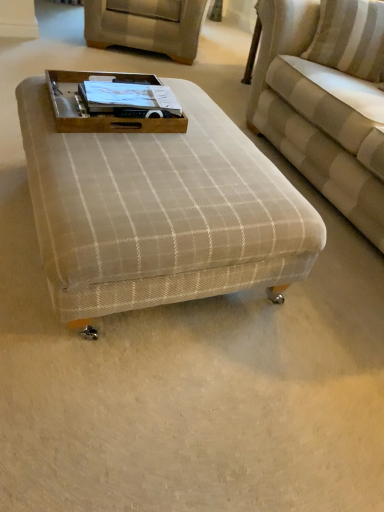
Measure the distance between point [139,74] and camera.

Point [139,74] and camera are 2.43 meters apart from each other.

Describe the element at coordinates (105, 111) in the screenshot. I see `brown wooden tray at center` at that location.

This screenshot has width=384, height=512. What do you see at coordinates (326, 100) in the screenshot? I see `beige striped fabric couch at upper right` at bounding box center [326, 100].

Locate an element on the screen. beige fabric swivel chair at upper center is located at coordinates (146, 26).

Is brown wooden tray at center located outside beige striped fabric couch at upper right?

Absolutely, brown wooden tray at center is external to beige striped fabric couch at upper right.

Based on their sizes in the image, would you say brown wooden tray at center is bigger or smaller than beige striped fabric couch at upper right?

In the image, brown wooden tray at center appears to be smaller than beige striped fabric couch at upper right.

Between brown wooden tray at center and beige striped fabric couch at upper right, which one has less height?

brown wooden tray at center.

Which object is positioned more to the right, beige plaid ottoman at center or beige fabric swivel chair at upper center?

Positioned to the right is beige plaid ottoman at center.

Locate an element on the screen. Image resolution: width=384 pixels, height=512 pixels. swivel chair on the left side of beige plaid ottoman at center is located at coordinates (146, 26).

Are beige plaid ottoman at center and beige fabric swivel chair at upper center making contact?

beige plaid ottoman at center and beige fabric swivel chair at upper center are not in contact.

What's the angular difference between beige plaid ottoman at center and beige fabric swivel chair at upper center's facing directions?

They differ by 67.4 degrees in their facing directions.

Considering the relative sizes of beige striped fabric couch at upper right and beige fabric swivel chair at upper center in the image provided, is beige striped fabric couch at upper right bigger than beige fabric swivel chair at upper center?

Correct, beige striped fabric couch at upper right is larger in size than beige fabric swivel chair at upper center.

Does point (298, 71) come behind point (91, 0)?

No, it is in front of (91, 0).

Choose the correct answer: Is beige striped fabric couch at upper right inside beige fabric swivel chair at upper center or outside it?

beige striped fabric couch at upper right is spatially situated outside beige fabric swivel chair at upper center.

Is beige striped fabric couch at upper right not close to beige fabric swivel chair at upper center?

Absolutely, beige striped fabric couch at upper right is distant from beige fabric swivel chair at upper center.

Who is smaller, brown wooden tray at center or beige plaid ottoman at center?

brown wooden tray at center is smaller.

Is beige plaid ottoman at center a part of brown wooden tray at center?

Definitely not — beige plaid ottoman at center is not inside brown wooden tray at center.

From a real-world perspective, who is located higher, brown wooden tray at center or beige plaid ottoman at center?

brown wooden tray at center, from a real-world perspective.

Does brown wooden tray at center touch beige plaid ottoman at center?

There is a gap between brown wooden tray at center and beige plaid ottoman at center.

Can you confirm if beige plaid ottoman at center is thinner than beige striped fabric couch at upper right?

Yes, beige plaid ottoman at center is thinner than beige striped fabric couch at upper right.

Is beige plaid ottoman at center touching beige striped fabric couch at upper right?

There is a gap between beige plaid ottoman at center and beige striped fabric couch at upper right.

Does point (110, 264) come in front of point (269, 126)?

Yes, it is.

From the image's perspective, does beige plaid ottoman at center appear lower than beige striped fabric couch at upper right?

Correct, beige plaid ottoman at center appears lower than beige striped fabric couch at upper right in the image.

Which object is wider, beige plaid ottoman at center or white striped pillow at upper right?

Wider between the two is beige plaid ottoman at center.

How many degrees apart are the facing directions of beige plaid ottoman at center and white striped pillow at upper right?

The angle between the facing direction of beige plaid ottoman at center and the facing direction of white striped pillow at upper right is 47.9 degrees.

Where is `table located on the left of white striped pillow at upper right`? This screenshot has width=384, height=512. table located on the left of white striped pillow at upper right is located at coordinates (160, 211).

Are beige plaid ottoman at center and white striped pillow at upper right beside each other?

No, beige plaid ottoman at center is not in contact with white striped pillow at upper right.

Is white striped pillow at upper right outside of beige fabric swivel chair at upper center?

Yes, white striped pillow at upper right is located beyond the bounds of beige fabric swivel chair at upper center.

Which is further, (x=355, y=49) or (x=183, y=19)?

The point (x=183, y=19) is behind.

Is white striped pillow at upper right facing towards beige fabric swivel chair at upper center?

No, white striped pillow at upper right is not turned towards beige fabric swivel chair at upper center.

Considering the relative sizes of white striped pillow at upper right and beige fabric swivel chair at upper center in the image provided, is white striped pillow at upper right shorter than beige fabric swivel chair at upper center?

Indeed, white striped pillow at upper right has a lesser height compared to beige fabric swivel chair at upper center.

Locate an element on the screen. This screenshot has height=512, width=384. studio couch in front of the brown wooden tray at center is located at coordinates (326, 100).

Find the location of a particular element. The width and height of the screenshot is (384, 512). swivel chair on the left of beige plaid ottoman at center is located at coordinates (146, 26).

Consider the image. Considering their positions, is beige striped fabric couch at upper right positioned closer to white striped pillow at upper right than beige fabric swivel chair at upper center?

beige striped fabric couch at upper right.

From the image, which object appears to be farther from beige plaid ottoman at center, brown wooden tray at center or beige striped fabric couch at upper right?

beige striped fabric couch at upper right is positioned further to the anchor beige plaid ottoman at center.

When comparing their distances from beige plaid ottoman at center, does white striped pillow at upper right or beige fabric swivel chair at upper center seem closer?

The object closer to beige plaid ottoman at center is white striped pillow at upper right.

Estimate the real-world distances between objects in this image. Which object is closer to beige plaid ottoman at center, beige striped fabric couch at upper right or brown wooden tray at center?

The object closer to beige plaid ottoman at center is brown wooden tray at center.

Based on their spatial positions, is beige fabric swivel chair at upper center or beige plaid ottoman at center closer to white striped pillow at upper right?

beige plaid ottoman at center is positioned closer to the anchor white striped pillow at upper right.

Based on their spatial positions, is beige striped fabric couch at upper right or beige plaid ottoman at center closer to brown wooden tray at center?

beige plaid ottoman at center.

Which object lies further to the anchor point beige plaid ottoman at center, brown wooden tray at center or beige fabric swivel chair at upper center?

beige fabric swivel chair at upper center lies further to beige plaid ottoman at center than the other object.

When comparing their distances from white striped pillow at upper right, does beige striped fabric couch at upper right or beige plaid ottoman at center seem closer?

The object closer to white striped pillow at upper right is beige striped fabric couch at upper right.

Identify the location of pillow situated between brown wooden tray at center and beige striped fabric couch at upper right from left to right. (350, 38).

Where is `pillow between beige plaid ottoman at center and beige striped fabric couch at upper right in the horizontal direction`? The image size is (384, 512). pillow between beige plaid ottoman at center and beige striped fabric couch at upper right in the horizontal direction is located at coordinates (350, 38).

You are a GUI agent. You are given a task and a screenshot of the screen. Output one action in this format:
    pyautogui.click(x=<x>, y=<y>)
    Task: Click on the studio couch located between beige plaid ottoman at center and beige fabric swivel chair at upper center in the depth direction
    The image size is (384, 512).
    Given the screenshot: What is the action you would take?
    click(x=326, y=100)

The image size is (384, 512). In order to click on table between brown wooden tray at center and white striped pillow at upper right in the horizontal direction in this screenshot , I will do `click(160, 211)`.